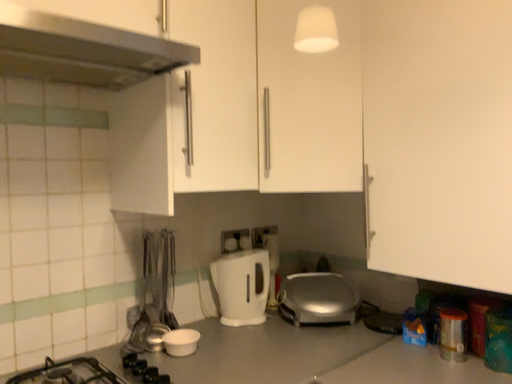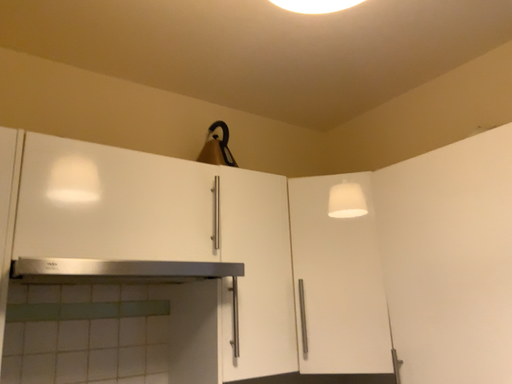
Question: How did the camera likely rotate when shooting the video?

Choices:
 (A) rotated right
 (B) rotated left

Answer: (B)